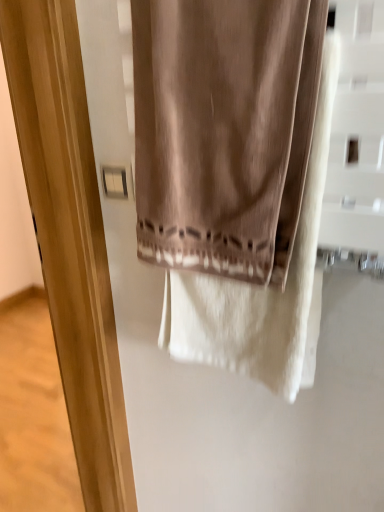
Question: Is white plastic light switch at upper left shorter than satin beige curtain at center?

Choices:
 (A) no
 (B) yes

Answer: (B)

Question: Is white plastic light switch at upper left wider than satin beige curtain at center?

Choices:
 (A) no
 (B) yes

Answer: (A)

Question: Is satin beige curtain at center located within white plastic light switch at upper left?

Choices:
 (A) yes
 (B) no

Answer: (B)

Question: From a real-world perspective, is white plastic light switch at upper left under satin beige curtain at center?

Choices:
 (A) no
 (B) yes

Answer: (B)

Question: Are white plastic light switch at upper left and satin beige curtain at center located far from each other?

Choices:
 (A) yes
 (B) no

Answer: (B)

Question: Is white plastic light switch at upper left at the right side of satin beige curtain at center?

Choices:
 (A) yes
 (B) no

Answer: (B)

Question: Can you confirm if matte wood screen door at center is thinner than satin beige curtain at center?

Choices:
 (A) yes
 (B) no

Answer: (B)

Question: Is matte wood screen door at center wider than satin beige curtain at center?

Choices:
 (A) no
 (B) yes

Answer: (B)

Question: Is matte wood screen door at center located outside satin beige curtain at center?

Choices:
 (A) yes
 (B) no

Answer: (A)

Question: Is matte wood screen door at center at the left side of satin beige curtain at center?

Choices:
 (A) no
 (B) yes

Answer: (B)

Question: From the image's perspective, does matte wood screen door at center appear higher than satin beige curtain at center?

Choices:
 (A) yes
 (B) no

Answer: (B)

Question: Is matte wood screen door at center shorter than satin beige curtain at center?

Choices:
 (A) no
 (B) yes

Answer: (A)

Question: Is satin beige curtain at center bigger than white plastic light switch at upper left?

Choices:
 (A) no
 (B) yes

Answer: (B)